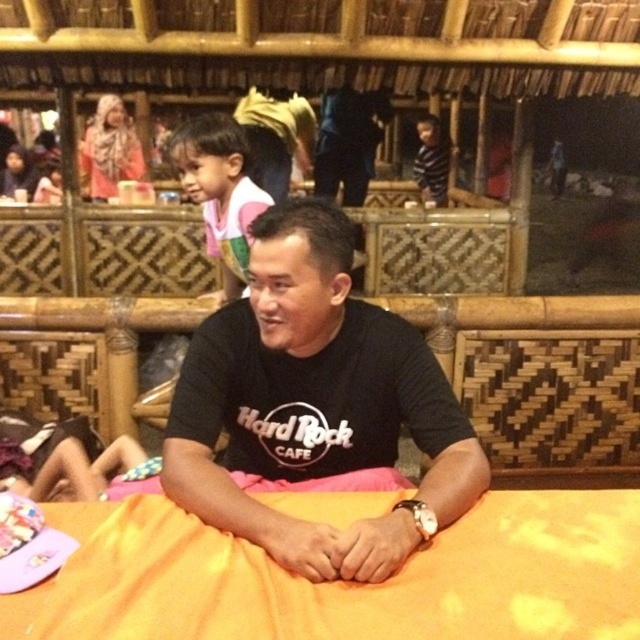
You are standing in a traditional setting and need to place a new decorative item exactly at the center of the orange fabric bed at center. What coordinates should you use?

The coordinates for the center of the orange fabric bed at center are at point (344,582).